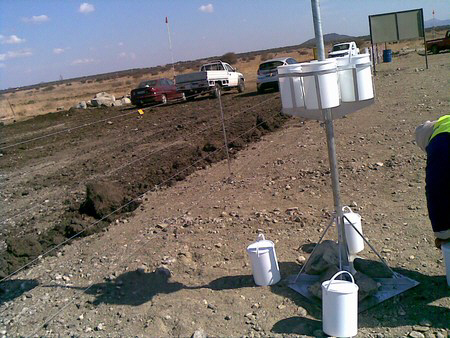
Locate an element on the screen. handle is located at coordinates (344, 272).